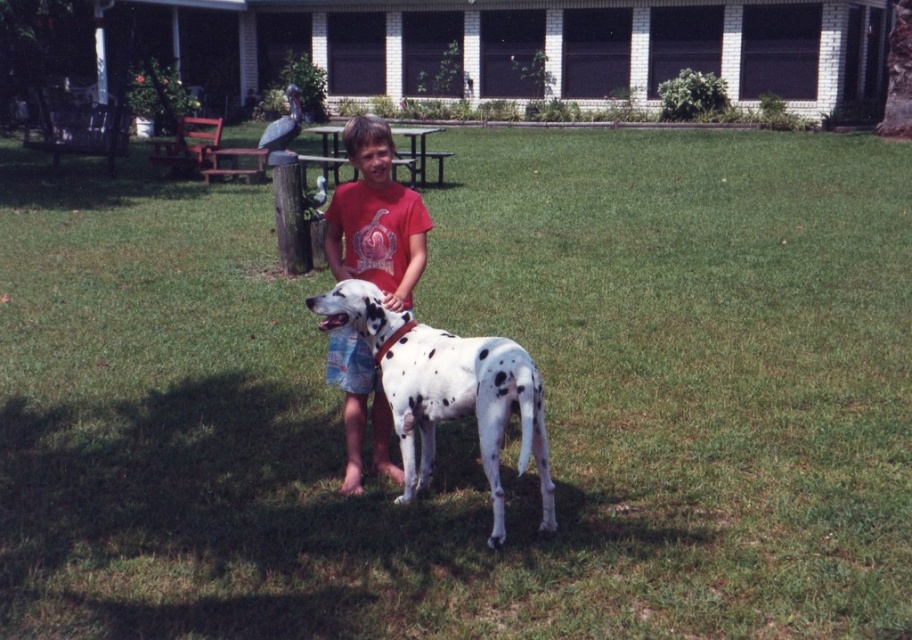
You are standing in the scene and want to reach the point at coordinates (333, 298). If you take a step forward of 5 feet, will you be closer to the point?

The point at coordinates (333, 298) is 16.42 feet from the viewer. Taking a step forward of 5 feet would bring you to 11.42 feet away, so yes, you will be closer to the point.